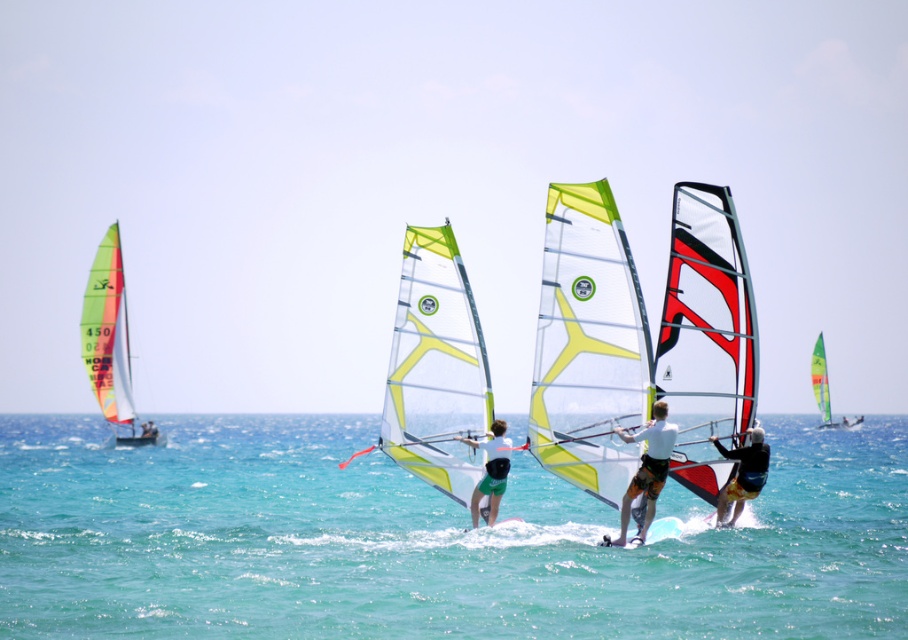
You are a windsurfer planning to choose a sail based on size for today. You see the translucent white sail at center and the green translucent sail at left. Which sail is smaller?

The translucent white sail at center is smaller than the green translucent sail at left.